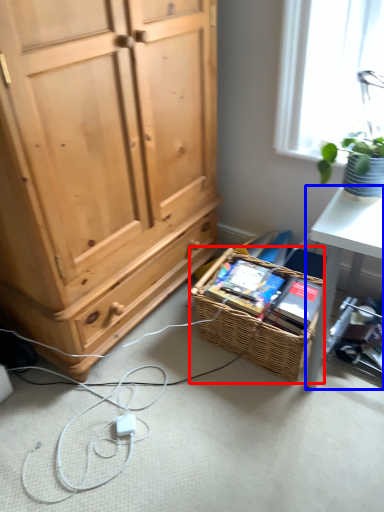
Question: Which of the following is the closest to the observer, picnic basket (highlighted by a red box) or desk (highlighted by a blue box)?

Choices:
 (A) picnic basket
 (B) desk

Answer: (A)